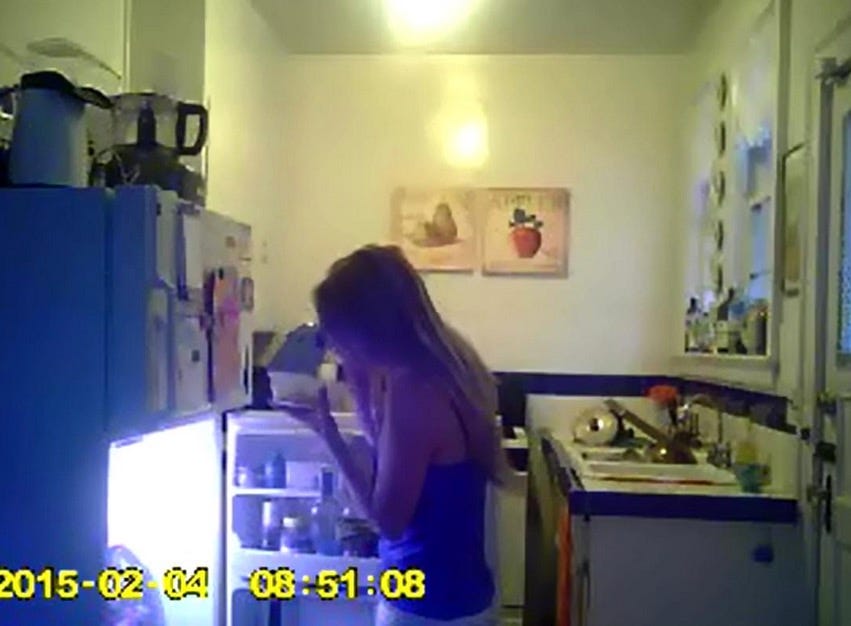
Identify the location of freezer door. The image size is (851, 626). (139, 350).